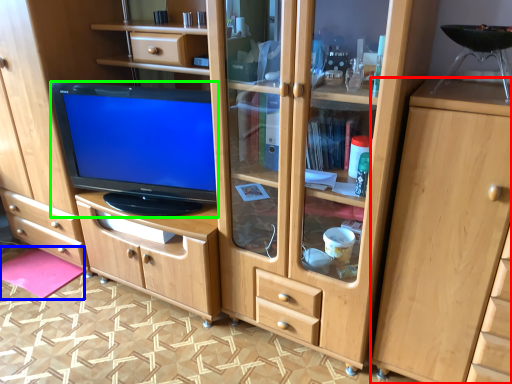
Question: Based on their relative distances, which object is nearer to cabinetry (highlighted by a red box)? Choose from flat (highlighted by a blue box) and television (highlighted by a green box).

Choices:
 (A) flat
 (B) television

Answer: (B)